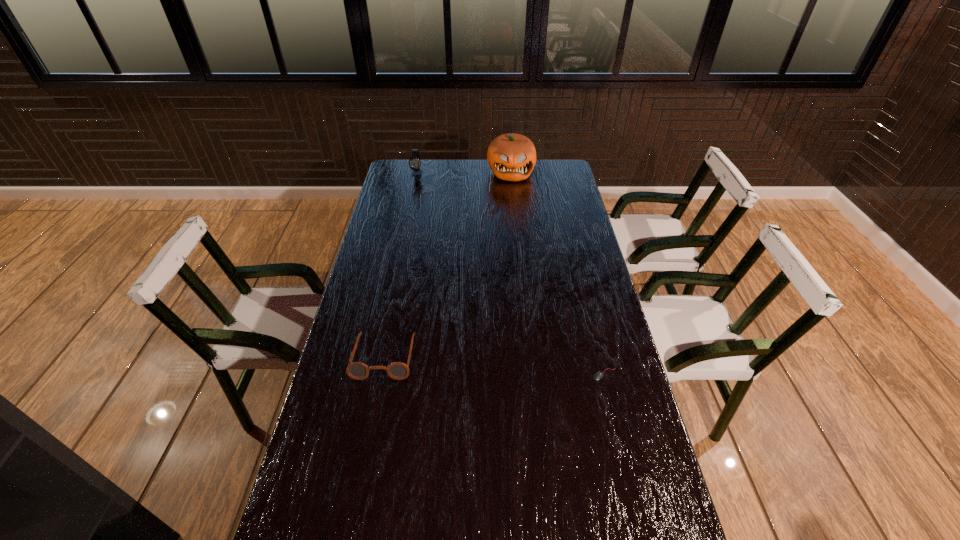
Identify which object is the third closest to the third tallest object. Please provide its 2D coordinates. Your answer should be formatted as a tuple, i.e. [(x, y)], where the tuple contains the x and y coordinates of a point satisfying the conditions above.

[(414, 162)]

Locate which object ranks in proximity to the rightmost object. Please provide its 2D coordinates. Your answer should be formatted as a tuple, i.e. [(x, y)], where the tuple contains the x and y coordinates of a point satisfying the conditions above.

[(356, 370)]

You are a GUI agent. You are given a task and a screenshot of the screen. Output one action in this format:
    pyautogui.click(x=<x>, y=<y>)
    Task: Click on the free spot that satisfies the following two spatial constraints: 1. on the front-facing side of the mouse; 2. on the left side of the second shortest object
    
    Given the screenshot: What is the action you would take?
    pyautogui.click(x=381, y=374)

Find the location of a particular element. This screenshot has width=960, height=540. vacant area in the image that satisfies the following two spatial constraints: 1. on the face of the mouse; 2. on the right side of the watch is located at coordinates (376, 374).

Locate an element on the screen. The height and width of the screenshot is (540, 960). vacant space that satisfies the following two spatial constraints: 1. on the front-facing side of the spectacles; 2. on the left side of the mouse is located at coordinates (381, 374).

This screenshot has width=960, height=540. In order to click on vacant position in the image that satisfies the following two spatial constraints: 1. on the face of the third shortest object; 2. on the left side of the mouse in this screenshot , I will do `click(376, 374)`.

Locate an element on the screen. The width and height of the screenshot is (960, 540). vacant region that satisfies the following two spatial constraints: 1. on the face of the pumpkin; 2. on the left side of the rightmost object is located at coordinates (531, 374).